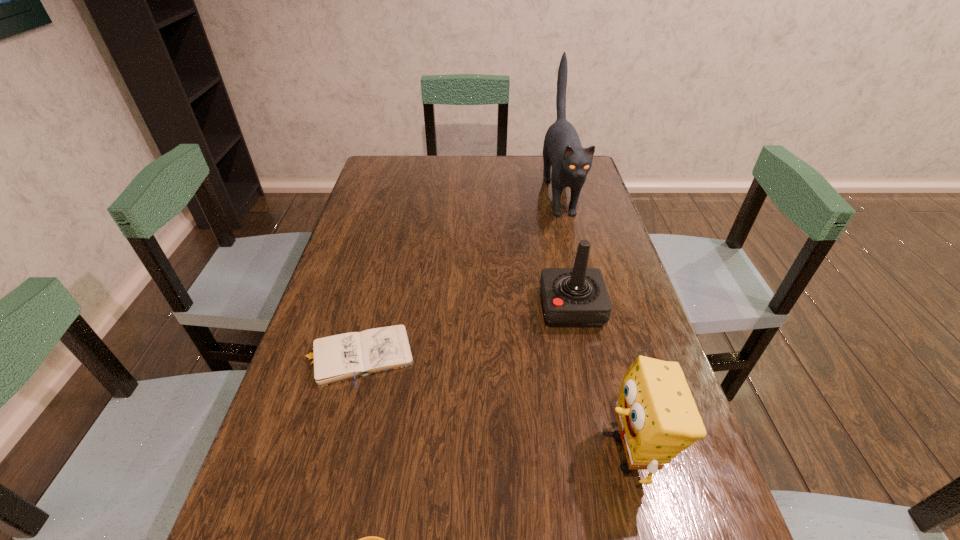
What are the coordinates of `free location that satisfies the following two spatial constraints: 1. on the front-facing side of the joystick; 2. on the front side of the shortest object` in the screenshot? It's located at (582, 356).